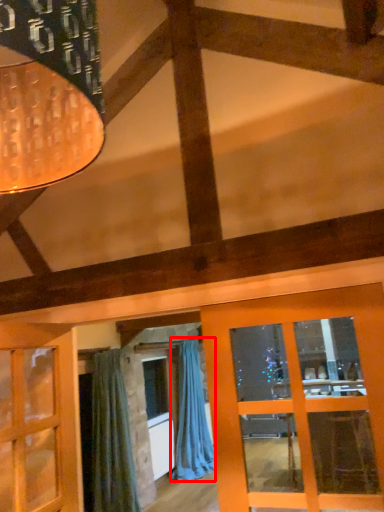
Question: Considering the relative positions of curtain (annotated by the red box) and curtain in the image provided, where is curtain (annotated by the red box) located with respect to the staircase?

Choices:
 (A) left
 (B) right

Answer: (B)